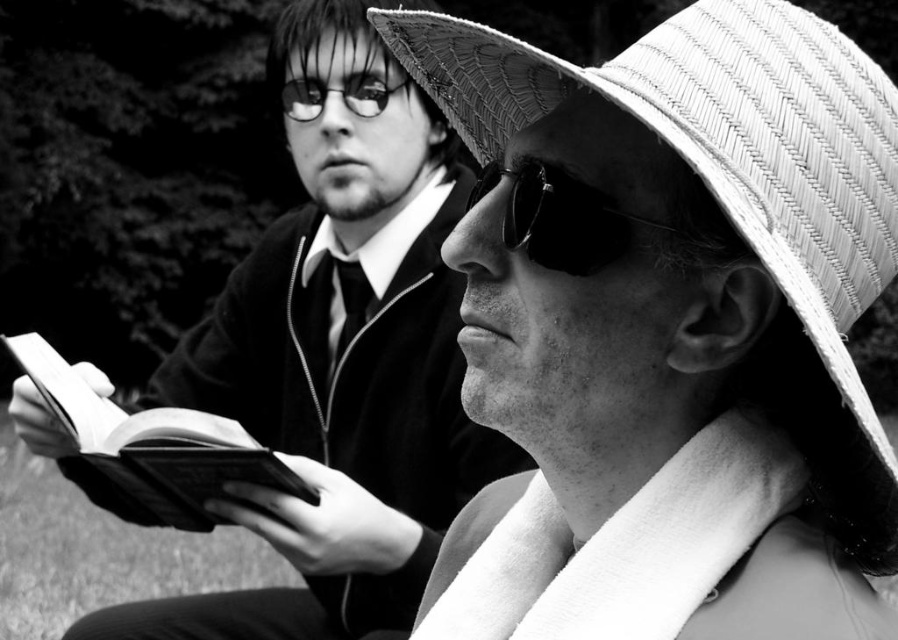
Question: Can you confirm if sunglasses at center is positioned above matte black glasses at upper center?

Choices:
 (A) yes
 (B) no

Answer: (B)

Question: Considering the real-world distances, which object is closest to the matte black glasses at upper center?

Choices:
 (A) matte black book at left
 (B) hardcover book at left
 (C) sunglasses at center

Answer: (A)

Question: Which of the following is the farthest from the observer?

Choices:
 (A) sunglasses at center
 (B) woven straw hat at upper right
 (C) hardcover book at left

Answer: (C)

Question: Is woven straw hat at upper right smaller than matte black glasses at upper center?

Choices:
 (A) yes
 (B) no

Answer: (B)

Question: Does matte black book at left have a smaller size compared to matte black glasses at upper center?

Choices:
 (A) yes
 (B) no

Answer: (B)

Question: Which point is farther from the camera taking this photo?

Choices:
 (A) (372, 216)
 (B) (596, 192)
 (C) (344, 92)
 (D) (797, 33)

Answer: (A)